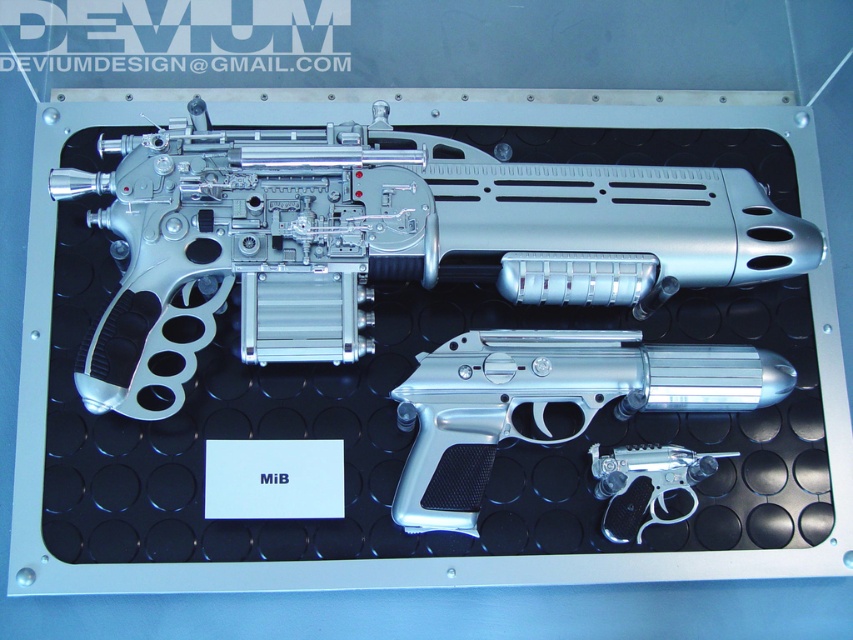
Is silver metallic rifle at upper center bigger than polished silver handgun at lower right?

Correct, silver metallic rifle at upper center is larger in size than polished silver handgun at lower right.

Is point (194, 333) positioned before point (654, 465)?

No, (194, 333) is further to viewer.

Find the location of a particular element. Image resolution: width=853 pixels, height=640 pixels. silver metallic rifle at upper center is located at coordinates (384, 237).

Is point (544, 417) positioned before point (601, 464)?

No.

Is silver metallic handgun at center positioned before polished silver handgun at lower right?

Yes, silver metallic handgun at center is in front of polished silver handgun at lower right.

Between point (492, 365) and point (662, 509), which one is positioned in front?

Point (492, 365)

At what (x,y) coordinates should I click in order to perform the action: click on silver metallic handgun at center. Please return your answer as a coordinate pair (x, y). Looking at the image, I should click on (549, 403).

Which is more to the left, silver metallic rifle at upper center or silver metallic handgun at center?

From the viewer's perspective, silver metallic rifle at upper center appears more on the left side.

Can you confirm if silver metallic rifle at upper center is shorter than silver metallic handgun at center?

No.

The height and width of the screenshot is (640, 853). What are the coordinates of `silver metallic rifle at upper center` in the screenshot? It's located at (384, 237).